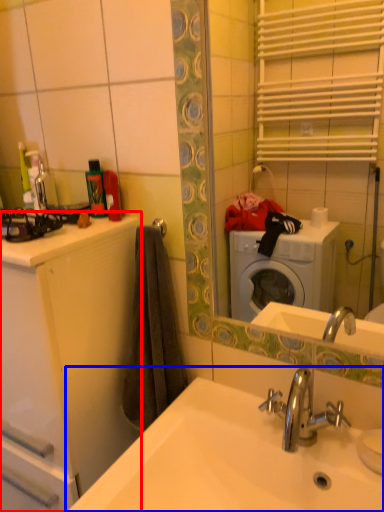
Question: Which of the following is the closest to the observer, bathroom cabinet (highlighted by a red box) or sink (highlighted by a blue box)?

Choices:
 (A) bathroom cabinet
 (B) sink

Answer: (B)